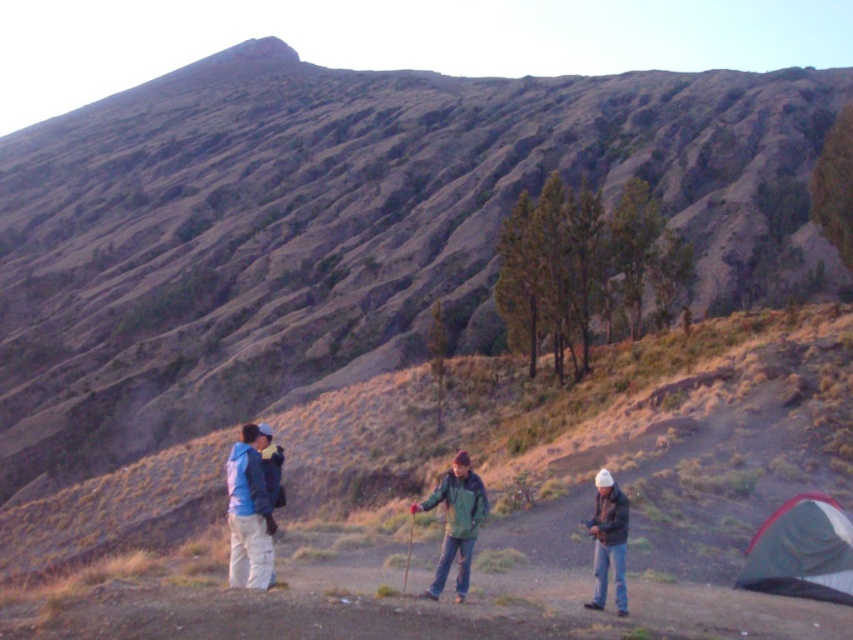
Question: Is brushed metal jacket at lower left bigger than white matte jacket at lower right?

Choices:
 (A) no
 (B) yes

Answer: (B)

Question: Is green fabric tent at lower right closer to the viewer compared to green matte jacket at center?

Choices:
 (A) yes
 (B) no

Answer: (B)

Question: Among these points, which one is farthest from the camera?

Choices:
 (A) (439, 586)
 (B) (601, 593)
 (C) (258, 502)
 (D) (827, 570)

Answer: (D)

Question: Does green matte jacket at center have a greater width compared to white matte jacket at lower right?

Choices:
 (A) no
 (B) yes

Answer: (B)

Question: Which object is farther from the camera taking this photo?

Choices:
 (A) brushed metal jacket at lower left
 (B) green matte jacket at center

Answer: (B)

Question: Among these objects, which one is farthest from the camera?

Choices:
 (A) green fabric tent at lower right
 (B) white matte jacket at lower right
 (C) green matte jacket at center

Answer: (A)